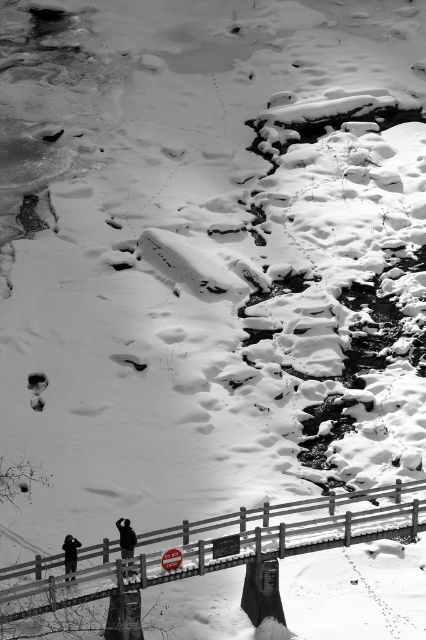
Question: Can you confirm if concrete bridge at center is thinner than black matte jacket at center?

Choices:
 (A) no
 (B) yes

Answer: (A)

Question: Does concrete bridge at center appear under black matte jacket at center?

Choices:
 (A) no
 (B) yes

Answer: (B)

Question: Which of the following is the closest to the observer?

Choices:
 (A) (331, 536)
 (B) (66, 564)

Answer: (B)

Question: Based on their relative distances, which object is farther from the concrete bridge at center?

Choices:
 (A) black matte person at lower left
 (B) black matte jacket at center

Answer: (A)

Question: Is black matte jacket at center bigger than black matte person at lower left?

Choices:
 (A) no
 (B) yes

Answer: (B)

Question: Which object appears closest to the camera in this image?

Choices:
 (A) concrete bridge at center
 (B) black matte jacket at center

Answer: (A)